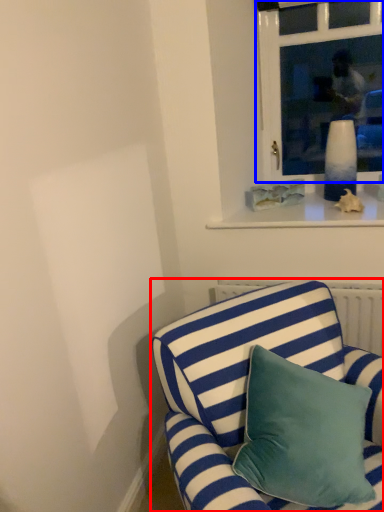
Question: Among these objects, which one is farthest to the camera, studio couch (highlighted by a red box) or window (highlighted by a blue box)?

Choices:
 (A) studio couch
 (B) window

Answer: (B)